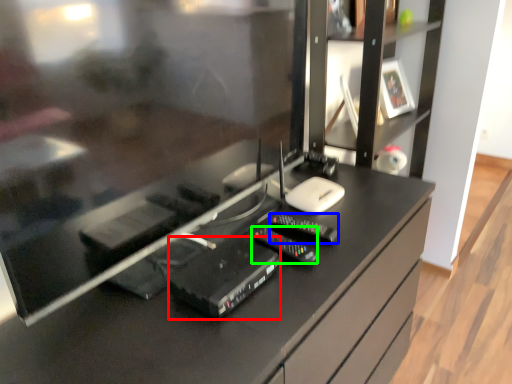
Question: Estimate the real-world distances between objects in this image. Which object is closer to equipment (highlighted by a red box), control (highlighted by a blue box) or equipment (highlighted by a green box)?

Choices:
 (A) control
 (B) equipment

Answer: (B)